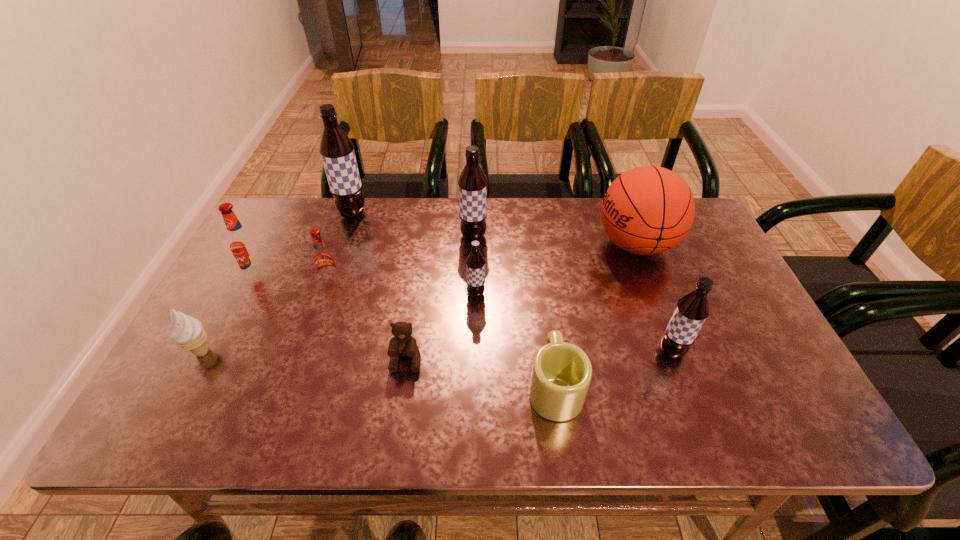
Locate an element on the screen. vacant space that is in between the icecream and the smallest brown root beer is located at coordinates (339, 323).

Identify the location of free spot between the fifth object from left to right and the beige mug. The image size is (960, 540). (480, 373).

Where is `vacant point located between the nearest brown root beer and the second farthest brown root beer`? The width and height of the screenshot is (960, 540). vacant point located between the nearest brown root beer and the second farthest brown root beer is located at coordinates (572, 294).

Identify the location of blank region between the nearest root beer and the right red root beer. (501, 316).

This screenshot has height=540, width=960. In order to click on vacant region between the rightmost root beer and the icecream in this screenshot , I will do click(437, 352).

The width and height of the screenshot is (960, 540). Identify the location of free space that is in between the biggest brown root beer and the smallest brown root beer. click(414, 254).

At what (x,y) coordinates should I click in order to perform the action: click on vacant space that is in between the basketball and the mug. Please return your answer as a coordinate pair (x, y). This screenshot has height=540, width=960. Looking at the image, I should click on (595, 315).

Find the location of a particular element. Image resolution: width=960 pixels, height=540 pixels. vacant region between the icecream and the fifth nearest root beer is located at coordinates (338, 294).

Find the location of a particular element. vacant space that is in between the second farthest brown root beer and the farthest root beer is located at coordinates (413, 225).

This screenshot has height=540, width=960. I want to click on vacant area that lies between the basketball and the tallest root beer, so click(x=494, y=229).